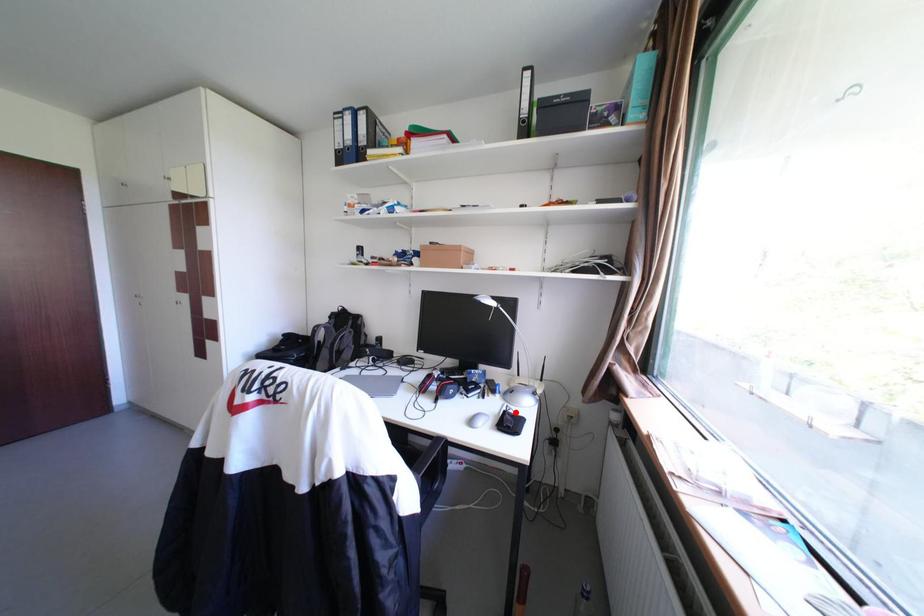
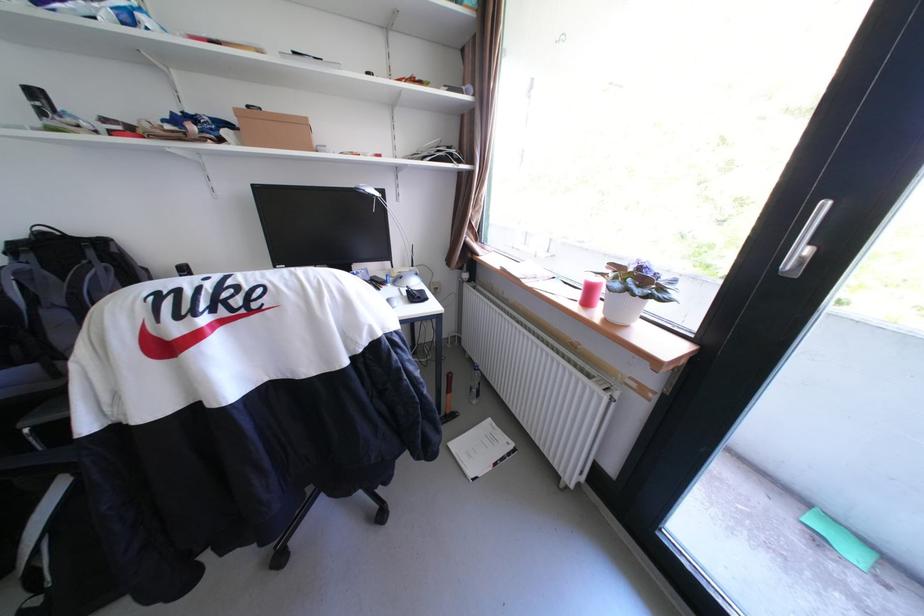
Find the pixel in the second image that matches the highlighted location in the first image.

(418, 291)